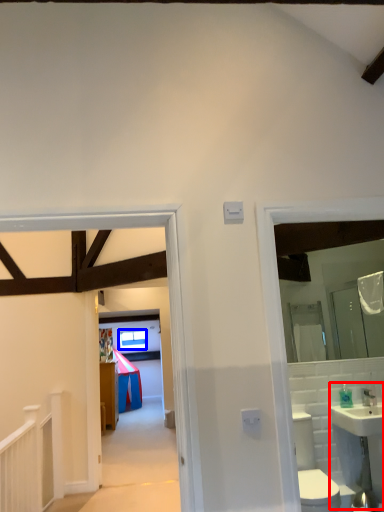
Question: Among these objects, which one is nearest to the camera, sink (highlighted by a red box) or window (highlighted by a blue box)?

Choices:
 (A) sink
 (B) window

Answer: (A)